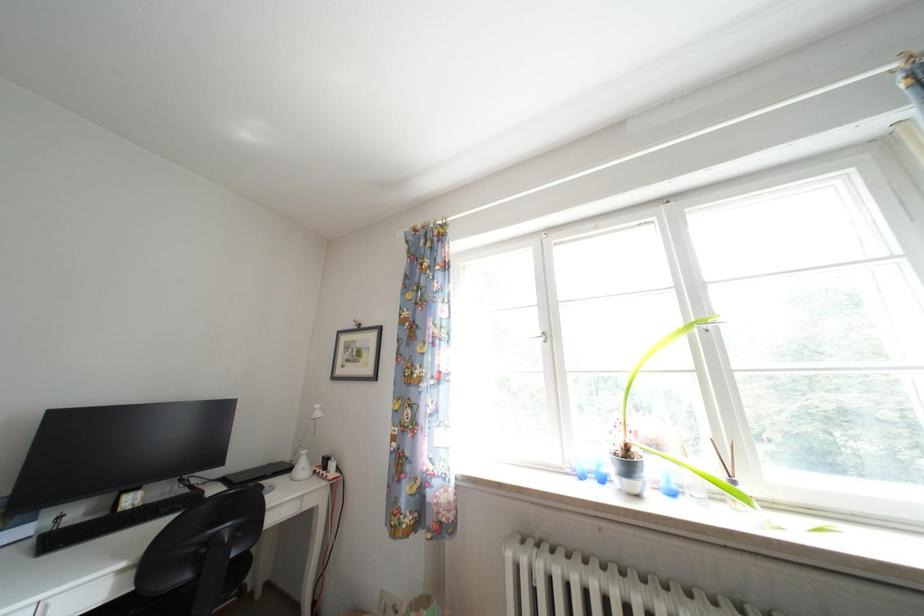
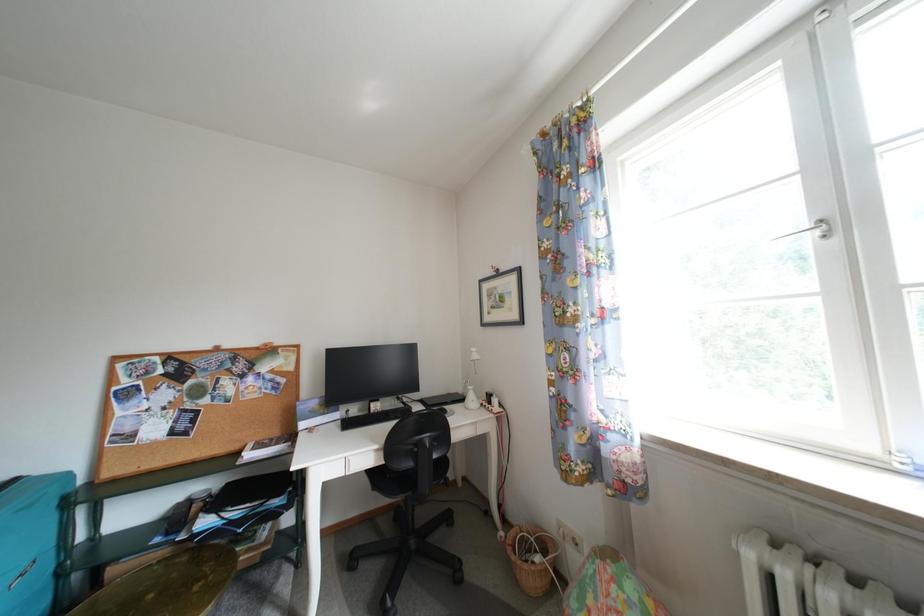
Question: How did the camera likely rotate?

Choices:
 (A) Left
 (B) Right
 (C) Up
 (D) Down

Answer: (A)